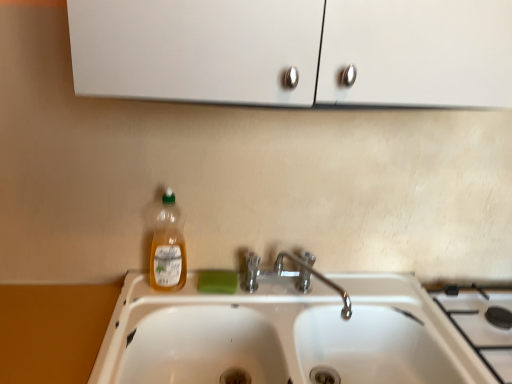
Identify the location of vacant space in front of green matte soap at sink. (218, 307).